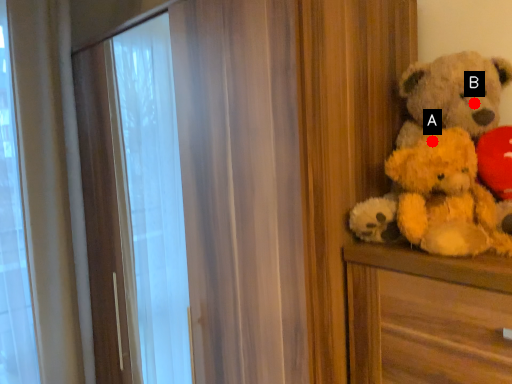
Question: Two points are circled on the image, labeled by A and B beside each circle. Among these points, which one is farthest from the camera?

Choices:
 (A) A is further
 (B) B is further

Answer: (B)